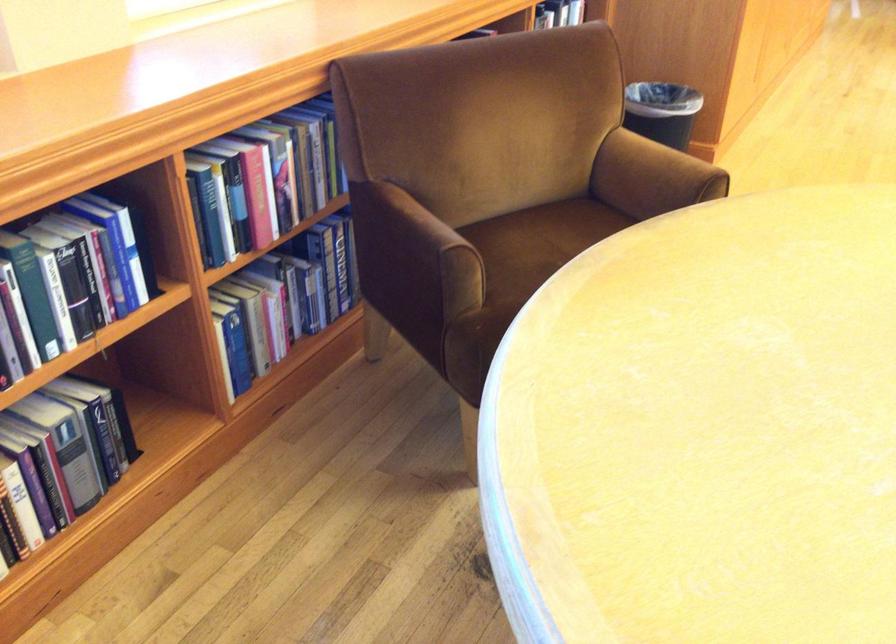
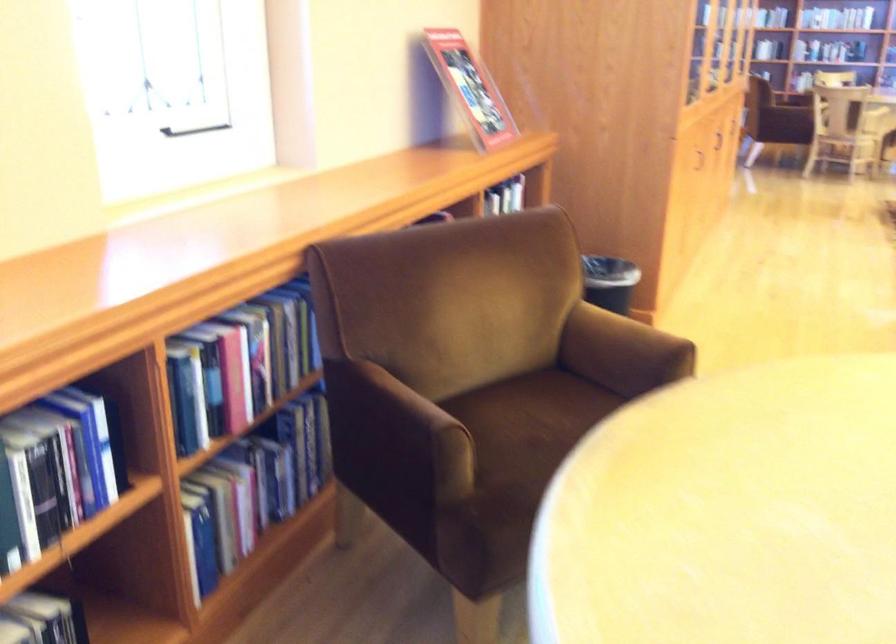
Question: In a continuous first-person perspective shot, in which direction is the camera moving?

Choices:
 (A) Left
 (B) Right
 (C) Forward
 (D) Backward

Answer: (A)